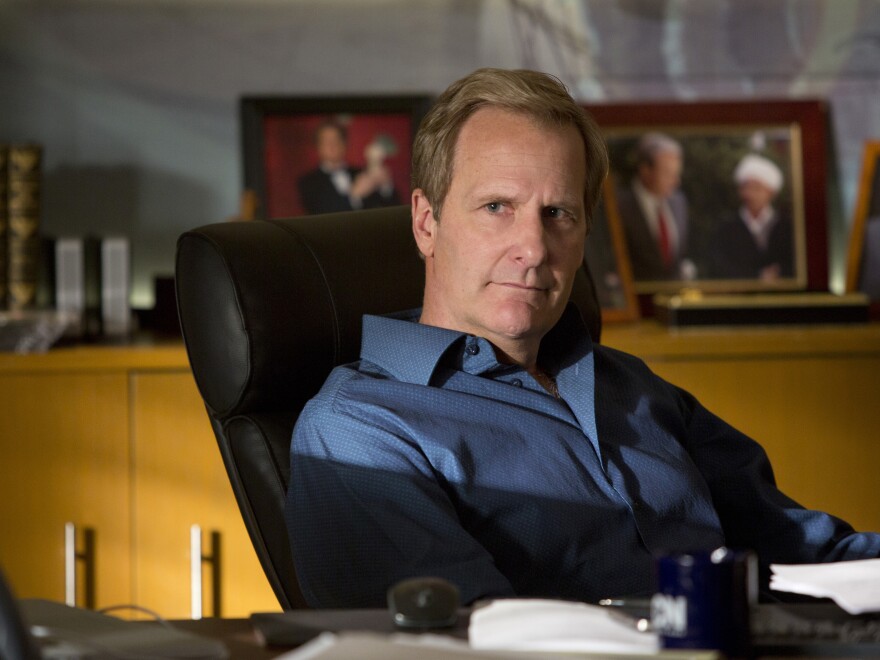
I want to click on picture, so click(x=326, y=148).